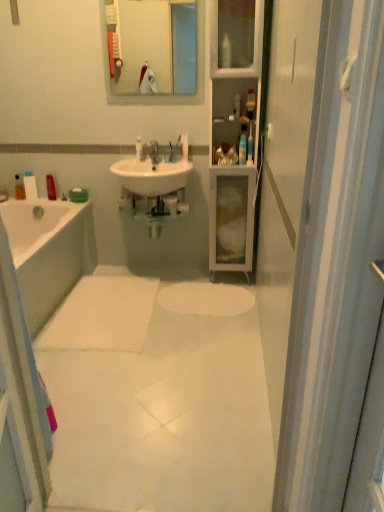
I want to click on free spot above white soft bath mat at center (from a real-world perspective), so click(101, 308).